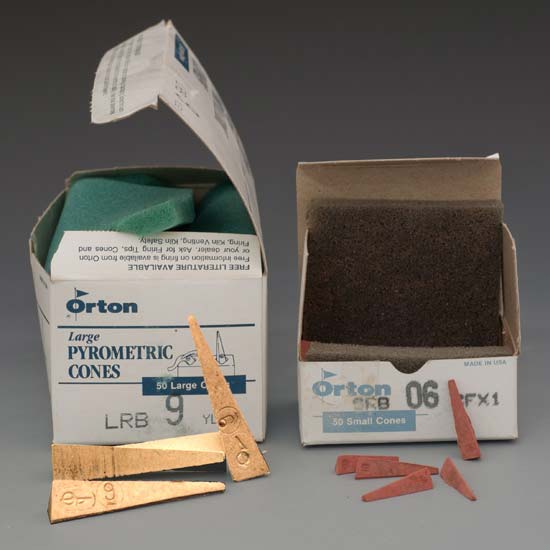
The image size is (550, 550). Identify the location of sponge. (400, 271), (214, 211), (132, 205).